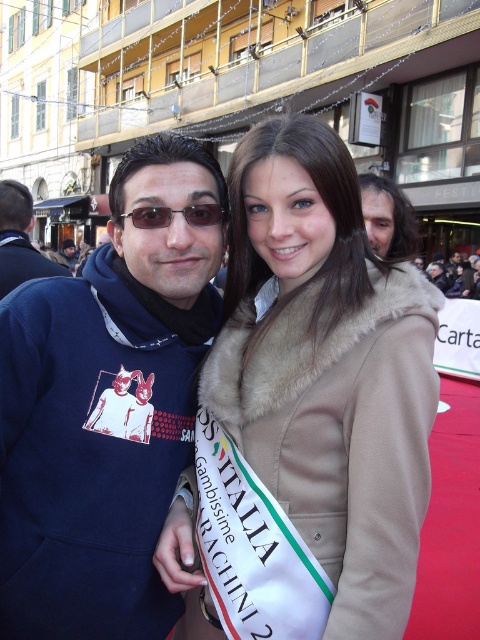
Question: Does matte blue hoodie at left appear over matte black sunglasses at center?

Choices:
 (A) no
 (B) yes

Answer: (B)

Question: Which object is farther from the camera taking this photo?

Choices:
 (A) beige fur coat at center
 (B) matte black sunglasses at center
 (C) matte blue hoodie at left

Answer: (C)

Question: Can you confirm if matte blue hoodie at left is positioned to the left of matte black sunglasses at center?

Choices:
 (A) no
 (B) yes

Answer: (B)

Question: Which object is closer to the camera taking this photo?

Choices:
 (A) beige fur coat at center
 (B) navy blue hoodie at left
 (C) matte black sunglasses at center

Answer: (A)

Question: Which of these objects is positioned farthest from the matte blue hoodie at left?

Choices:
 (A) navy blue hoodie at left
 (B) beige fur coat at center
 (C) matte black sunglasses at center

Answer: (B)

Question: Does beige fur coat at center appear on the left side of navy blue hoodie at left?

Choices:
 (A) yes
 (B) no

Answer: (B)